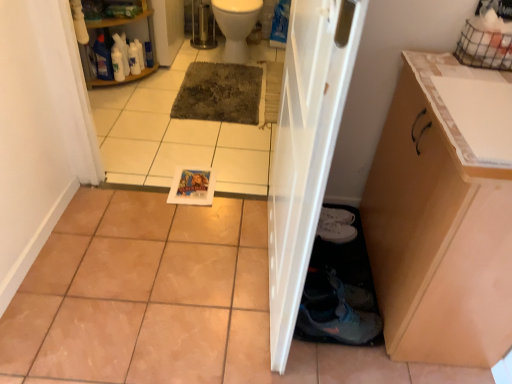
Locate an element on the screen. Image resolution: width=512 pixels, height=384 pixels. vacant space situated on the left part of white glossy door at center is located at coordinates (163, 271).